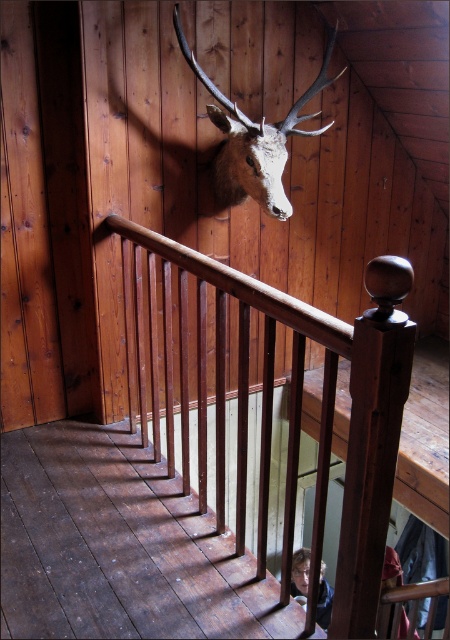
Does wooden stair at lower center have a greater width compared to wooden polished rail at center?

Yes, wooden stair at lower center is wider than wooden polished rail at center.

Consider the image. Who is positioned more to the right, wooden stair at lower center or wooden polished rail at center?

wooden polished rail at center

Is point (67, 508) less distant than point (367, 400)?

No, it is behind (367, 400).

Locate an element on the screen. This screenshot has width=450, height=640. wooden stair at lower center is located at coordinates (118, 547).

Who is shorter, wooden polished rail at center or smooth brown hair at lower center?

Standing shorter between the two is smooth brown hair at lower center.

Between wooden polished rail at center and smooth brown hair at lower center, which one appears on the right side from the viewer's perspective?

smooth brown hair at lower center

Between point (284, 524) and point (295, 586), which one is positioned in front?

Point (284, 524) is in front.

The width and height of the screenshot is (450, 640). What are the coordinates of `wooden polished rail at center` in the screenshot? It's located at (295, 410).

Is point (157, 428) less distant than point (274, 134)?

Yes, it is.

Between wooden polished rail at center and matte brown deer head at upper center, which one has less height?

matte brown deer head at upper center

Is point (260, 561) closer to camera compared to point (217, 115)?

Yes.

In order to click on wooden polished rail at center in this screenshot , I will do `click(295, 410)`.